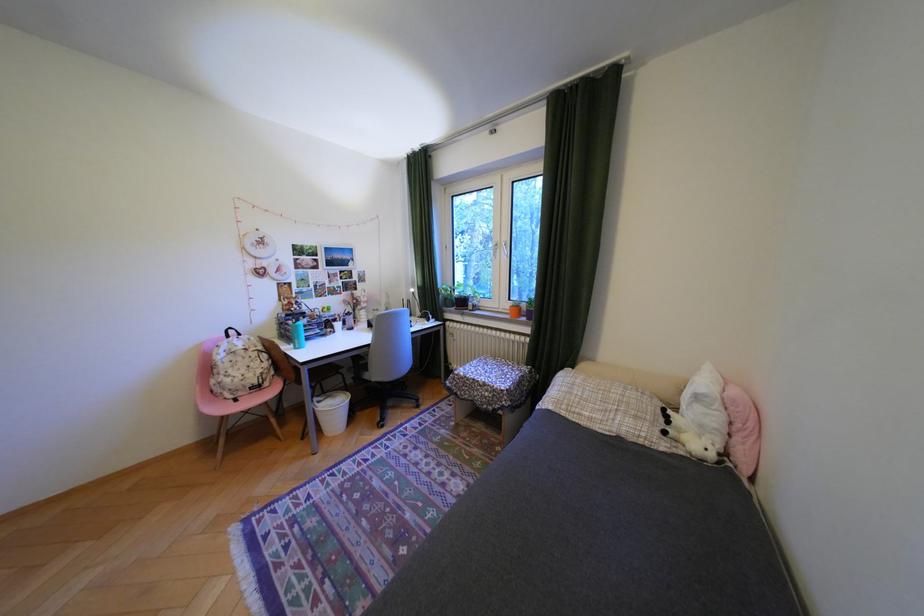
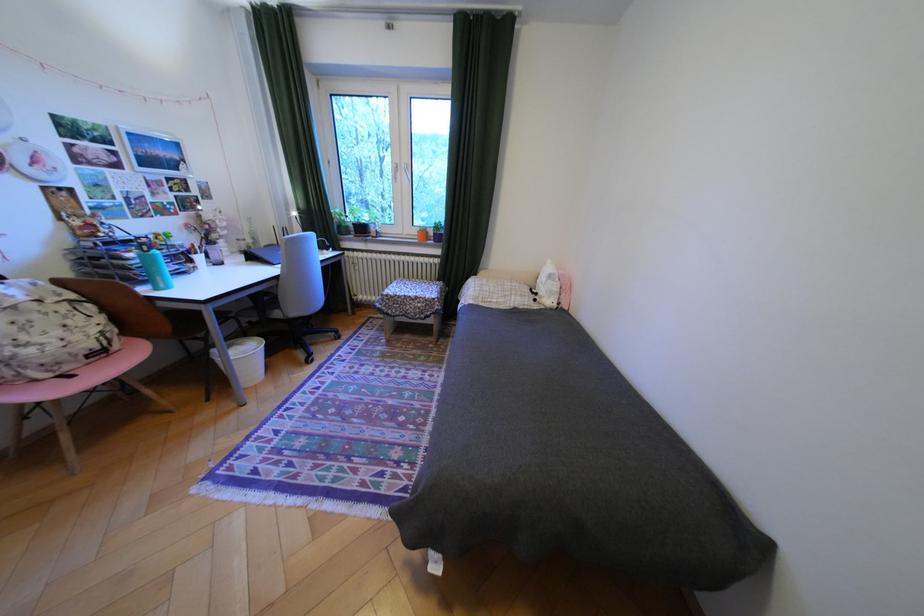
The point at (464, 301) is marked in the first image. Where is the corresponding point in the second image?

(359, 227)